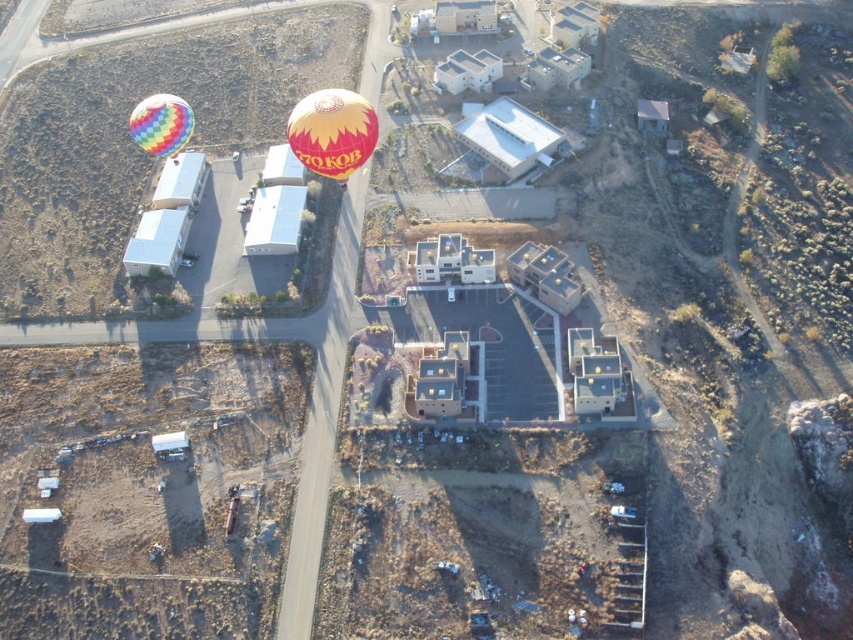
Question: Which point is farther from the camera taking this photo?

Choices:
 (A) (170, 99)
 (B) (323, 93)

Answer: (A)

Question: Is yellow and orange fabric balloon at center above rainbow striped balloon at upper left?

Choices:
 (A) no
 (B) yes

Answer: (A)

Question: Does yellow and orange fabric balloon at center come in front of rainbow striped balloon at upper left?

Choices:
 (A) no
 (B) yes

Answer: (B)

Question: Among these objects, which one is nearest to the camera?

Choices:
 (A) rainbow striped balloon at upper left
 (B) yellow and orange fabric balloon at center

Answer: (B)

Question: Can you confirm if yellow and orange fabric balloon at center is thinner than rainbow striped balloon at upper left?

Choices:
 (A) yes
 (B) no

Answer: (A)